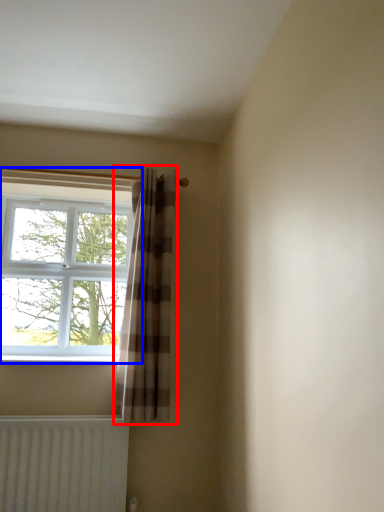
Question: Which object appears farthest to the camera in this image, curtain (highlighted by a red box) or window (highlighted by a blue box)?

Choices:
 (A) curtain
 (B) window

Answer: (B)